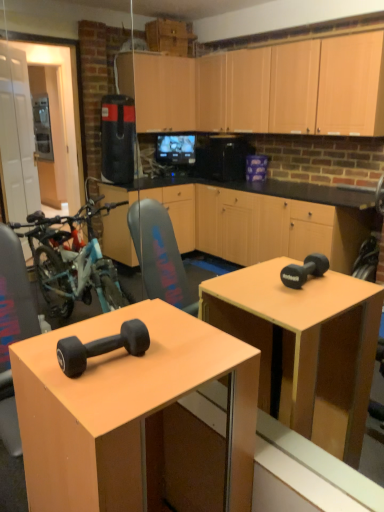
Locate an element on the screen. This screenshot has height=512, width=384. free point to the left of black rubber dumbbell at lower left is located at coordinates (39, 357).